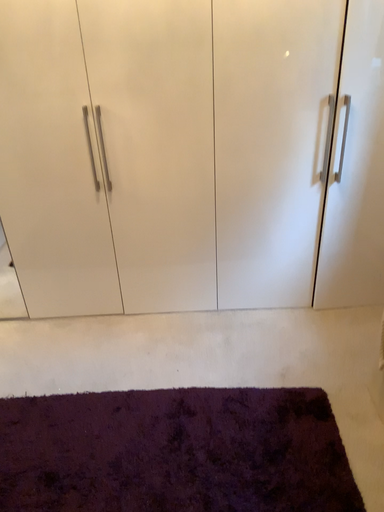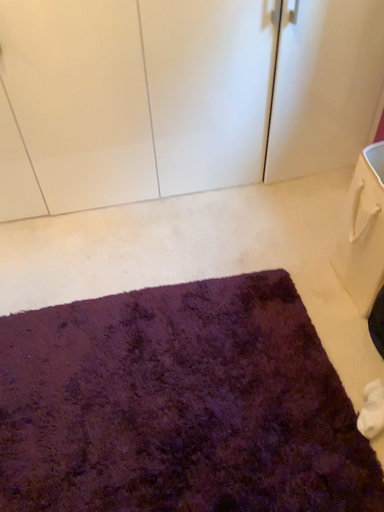
Question: Which way did the camera rotate in the video?

Choices:
 (A) rotated downward
 (B) rotated upward

Answer: (A)